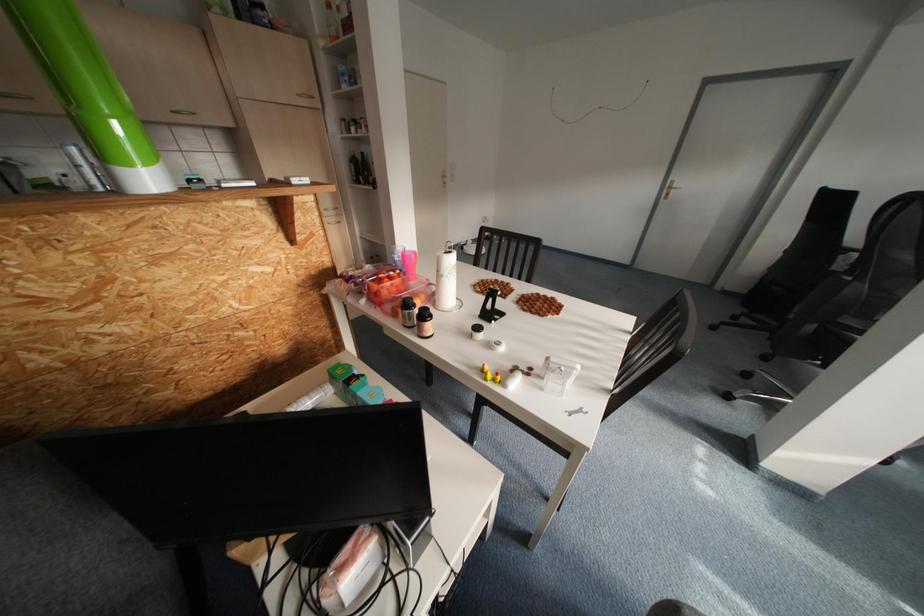
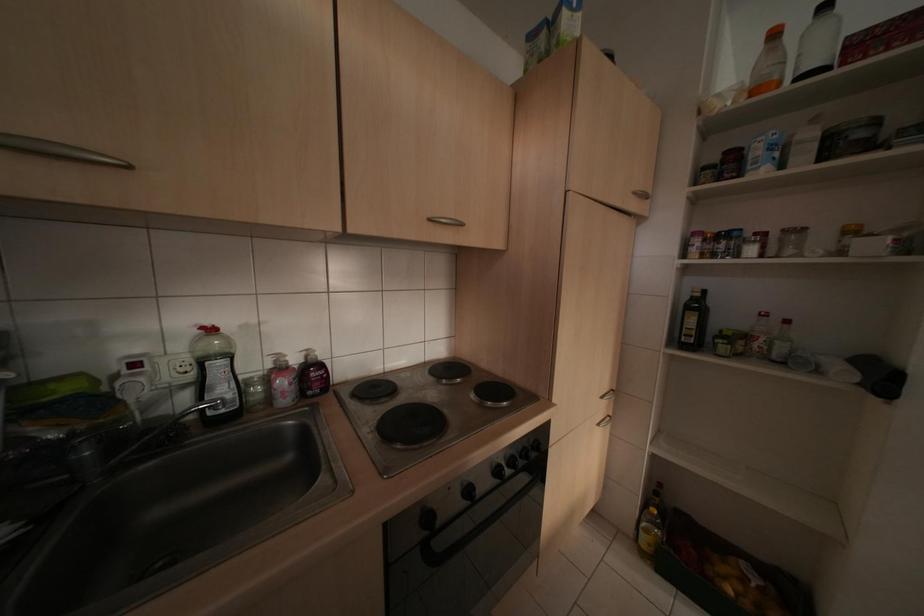
In a continuous first-person perspective shot, in which direction is the camera moving?

The cameraman moved toward left, forward.